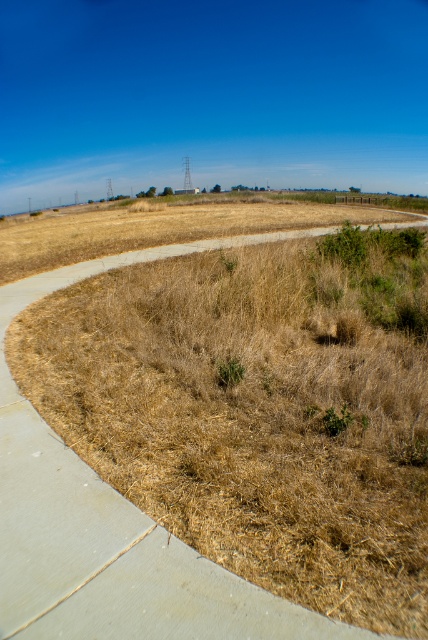
Based on the photo, is brown dry grass at center closer to camera compared to green leafy weed at center?

Yes, brown dry grass at center is closer to the viewer.

Is brown dry grass at center to the right of green leafy weed at center from the viewer's perspective?

In fact, brown dry grass at center is to the left of green leafy weed at center.

Which is behind, point (285, 605) or point (243, 376)?

Point (243, 376)

This screenshot has height=640, width=428. I want to click on brown dry grass at center, so click(x=113, y=524).